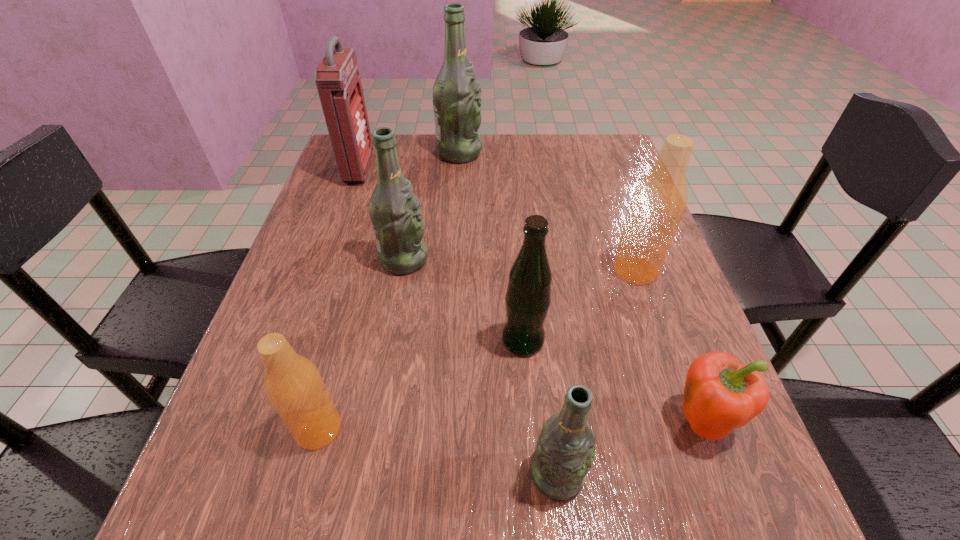
Locate an element on the screen. The height and width of the screenshot is (540, 960). the nearer tan beer bottle is located at coordinates (292, 383).

What are the coordinates of `the smallest green beer bottle` in the screenshot? It's located at (565, 449).

In order to click on orange pepper in this screenshot , I will do `click(720, 395)`.

Identify the location of the shortest object. (720, 395).

Find the location of a particular element. free space located 0.080m on the surface of the farthest green beer bottle is located at coordinates (511, 153).

Where is `vacant area situated on the front-facing side of the red first-aid kit`? This screenshot has width=960, height=540. vacant area situated on the front-facing side of the red first-aid kit is located at coordinates (393, 170).

In order to click on vacant space located 0.340m on the surface of the second farthest green beer bottle in this screenshot , I will do point(586,259).

Locate an element on the screen. The height and width of the screenshot is (540, 960). free space located on the back of the bigger tan beer bottle is located at coordinates (600, 167).

At what (x,y) coordinates should I click in order to perform the action: click on vacant area located 0.340m on the left of the fifth farthest object. Please return your answer as a coordinate pair (x, y). Looking at the image, I should click on (316, 341).

You are a GUI agent. You are given a task and a screenshot of the screen. Output one action in this format:
    pyautogui.click(x=<x>, y=<y>)
    Task: Click on the vacant point located 0.050m on the right of the smaller tan beer bottle
    
    Given the screenshot: What is the action you would take?
    pyautogui.click(x=373, y=429)